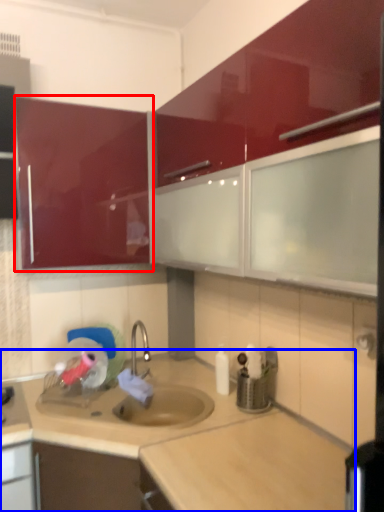
Question: Which of the following is the farthest to the observer, cabinetry (highlighted by a red box) or countertop (highlighted by a blue box)?

Choices:
 (A) cabinetry
 (B) countertop

Answer: (A)